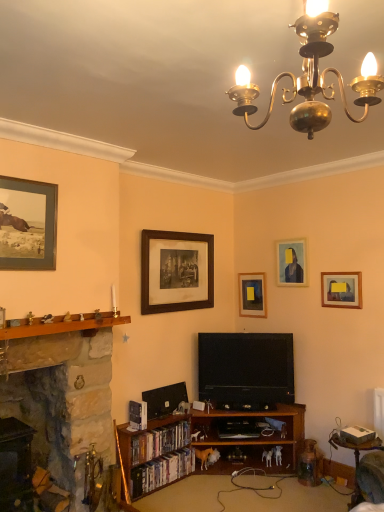
Question: From their relative heights in the image, would you say wooden bookshelf at lower center is taller or shorter than matte wooden picture frame at upper left, the 5th picture frame from the right?

Choices:
 (A) tall
 (B) short

Answer: (B)

Question: From the image's perspective, is wooden bookshelf at lower center located above or below matte wooden picture frame at upper left, which ranks as the 1th picture frame in left-to-right order?

Choices:
 (A) above
 (B) below

Answer: (B)

Question: Estimate the real-world distances between objects in this image. Which object is farther from the matte yellow portrait at upper right, which is the 2th picture frame in front-to-back order?

Choices:
 (A) wooden bookshelf at lower center
 (B) wooden picture frame at center, placed as the third picture frame when sorted from left to right
 (C) black glossy bookshelf at lower left, the first book when ordered from bottom to top
 (D) matte wooden picture frame at upper right, the fourth picture frame from the left
 (E) wooden round table at lower right

Answer: (C)

Question: Which object is the closest to the stone fireplace at left?

Choices:
 (A) matte wooden picture frame at upper right, which is counted as the fourth picture frame, starting from the front
 (B) wooden at left
 (C) wooden bookshelf at lower center
 (D) matte wooden picture frame at upper left, the 5th picture frame from the right
 (E) wooden picture frame at center, which is counted as the fifth picture frame, starting from the front

Answer: (B)